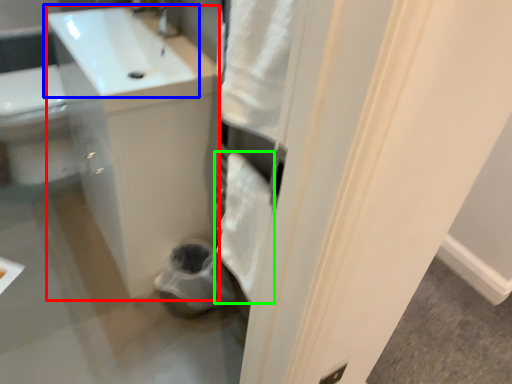
Question: Estimate the real-world distances between objects in this image. Which object is closer to counter top (highlighted by a red box), sink (highlighted by a blue box) or bath towel (highlighted by a green box)?

Choices:
 (A) sink
 (B) bath towel

Answer: (A)